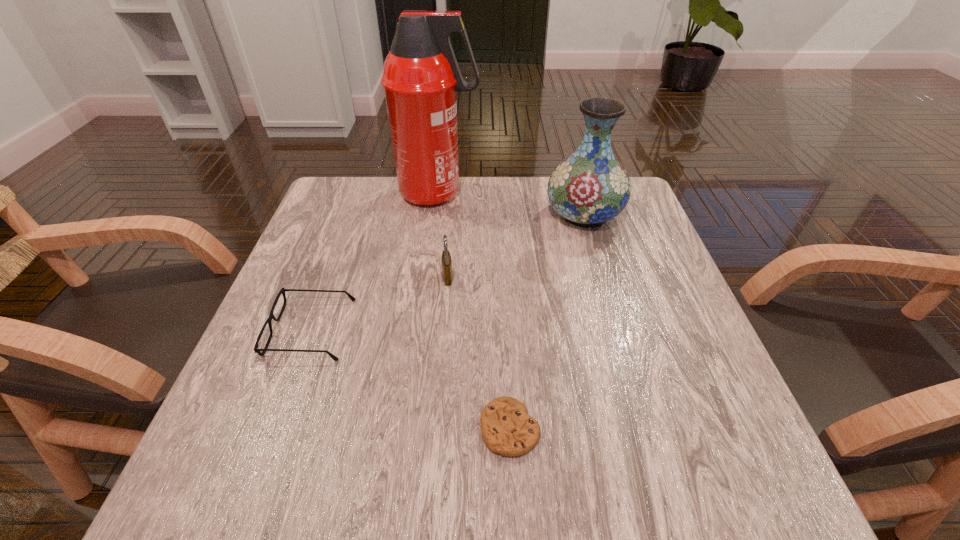
At what (x,y) coordinates should I click in order to perform the action: click on free spot at the left edge of the desktop. Please return your answer as a coordinate pair (x, y). The image size is (960, 540). Looking at the image, I should click on click(274, 388).

In the image, there is a desktop. Where is `vacant region at the right edge`? vacant region at the right edge is located at coordinates (633, 250).

Identify the location of free space at the near left corner of the desktop. The width and height of the screenshot is (960, 540). tap(190, 476).

Find the location of a particular element. This screenshot has width=960, height=540. vacant space at the near right corner of the desktop is located at coordinates (732, 502).

You are a GUI agent. You are given a task and a screenshot of the screen. Output one action in this format:
    pyautogui.click(x=<x>, y=<y>)
    Task: Click on the free spot between the shortest object and the rightmost object
    This screenshot has width=960, height=540.
    Given the screenshot: What is the action you would take?
    pyautogui.click(x=547, y=321)

You are a GUI agent. You are given a task and a screenshot of the screen. Output one action in this format:
    pyautogui.click(x=<x>, y=<y>)
    Task: Click on the vacant area that lies between the fourth tallest object and the cookie
    The width and height of the screenshot is (960, 540).
    Given the screenshot: What is the action you would take?
    pyautogui.click(x=411, y=379)

Where is `free spot between the nearest object and the fire extinguisher`? This screenshot has width=960, height=540. free spot between the nearest object and the fire extinguisher is located at coordinates (474, 311).

Image resolution: width=960 pixels, height=540 pixels. Identify the location of free spot between the fire extinguisher and the vase. (511, 204).

Where is `unoccupied position between the second object from right to left and the third shortest object`? unoccupied position between the second object from right to left and the third shortest object is located at coordinates (479, 353).

What are the coordinates of `empty location between the nearest object and the third shortest object` in the screenshot? It's located at (479, 353).